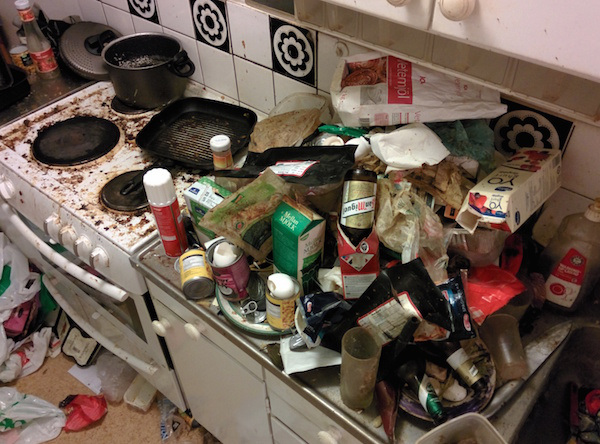
At what (x,y) coordinates should I click in order to perform the action: click on back splash. Please return your answer as a coordinate pair (x, y). Looking at the image, I should click on (252, 69).